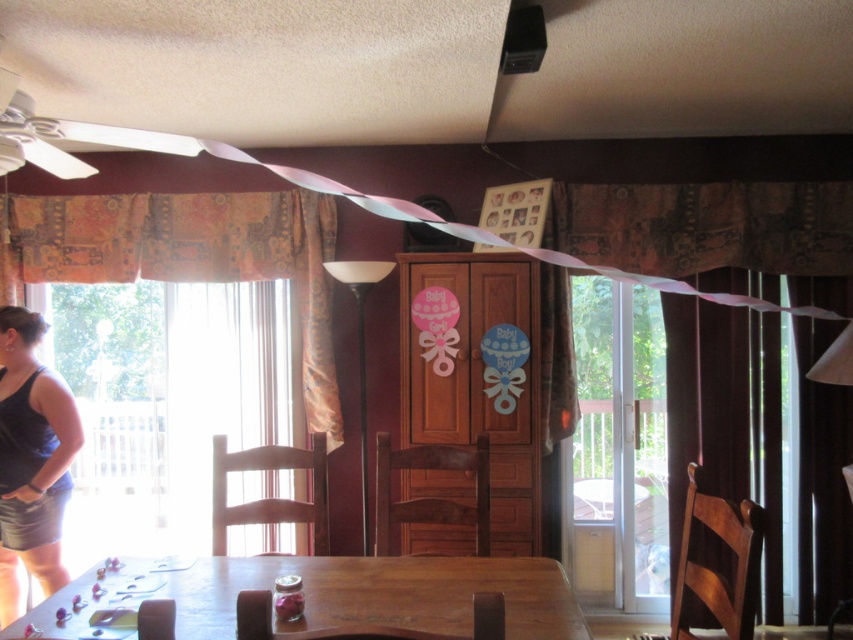
Question: Which of these objects is positioned closest to the black fabric at left?

Choices:
 (A) wooden table at lower center
 (B) patterned fabric curtain at left

Answer: (B)

Question: Which object is closer to the camera taking this photo?

Choices:
 (A) wooden table at lower center
 (B) black fabric at left
 (C) patterned fabric curtain at left

Answer: (A)

Question: Which point appears closest to the camera in this image?

Choices:
 (A) (38, 401)
 (B) (563, 627)
 (C) (25, 211)

Answer: (B)

Question: Is wooden table at lower center to the right of black fabric at left from the viewer's perspective?

Choices:
 (A) yes
 (B) no

Answer: (A)

Question: Does patterned fabric curtain at left have a lesser width compared to black fabric at left?

Choices:
 (A) yes
 (B) no

Answer: (B)

Question: Is patterned fabric curtain at left below black fabric at left?

Choices:
 (A) no
 (B) yes

Answer: (A)